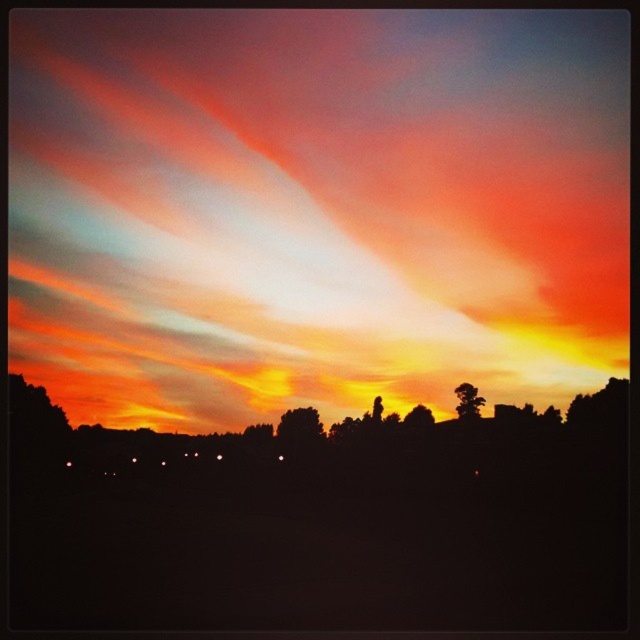
You are standing at the point labeled point [612,349] and want to reach the nearest light source. The nearest light source is 8.03 meters away from you. Can you estimate how far you need to walk to reach it?

The nearest light source is 8.03 meters away from the point labeled point [612,349], so you need to walk approximately 8.03 meters to reach it.

In the scene shown: You are an artist trying to paint the sunset scene. You notice two trees in the image. Which tree, the brown textured tree at upper right or the silky brown tree at center, should you paint first if you want to follow the rule of painting larger objects before smaller ones?

The brown textured tree at upper right is bigger than the silky brown tree at center, so you should paint the brown textured tree at upper right first.